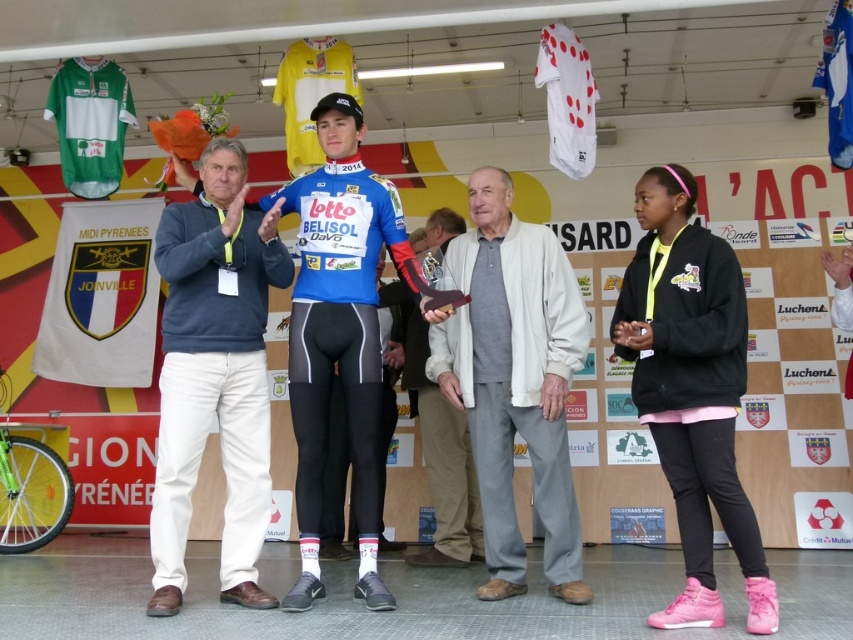
Image resolution: width=853 pixels, height=640 pixels. I want to click on white cotton jacket at center, so click(x=514, y=380).

Can you confirm if white cotton jacket at center is positioned to the right of light gray wool sweater at center?

Indeed, white cotton jacket at center is positioned on the right side of light gray wool sweater at center.

Does point (537, 230) come closer to viewer compared to point (461, 480)?

Yes, point (537, 230) is in front of point (461, 480).

Identify the location of white cotton jacket at center. (514, 380).